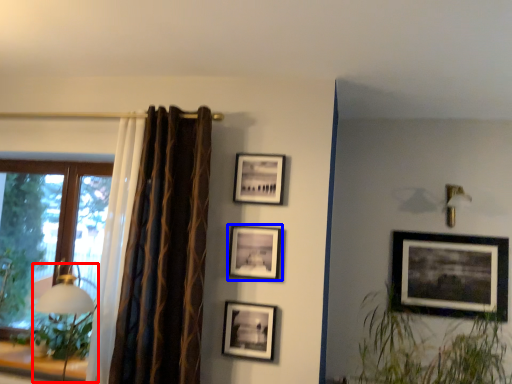
Question: Which point is further to the camera, table lamp (highlighted by a red box) or picture frame (highlighted by a blue box)?

Choices:
 (A) table lamp
 (B) picture frame

Answer: (B)